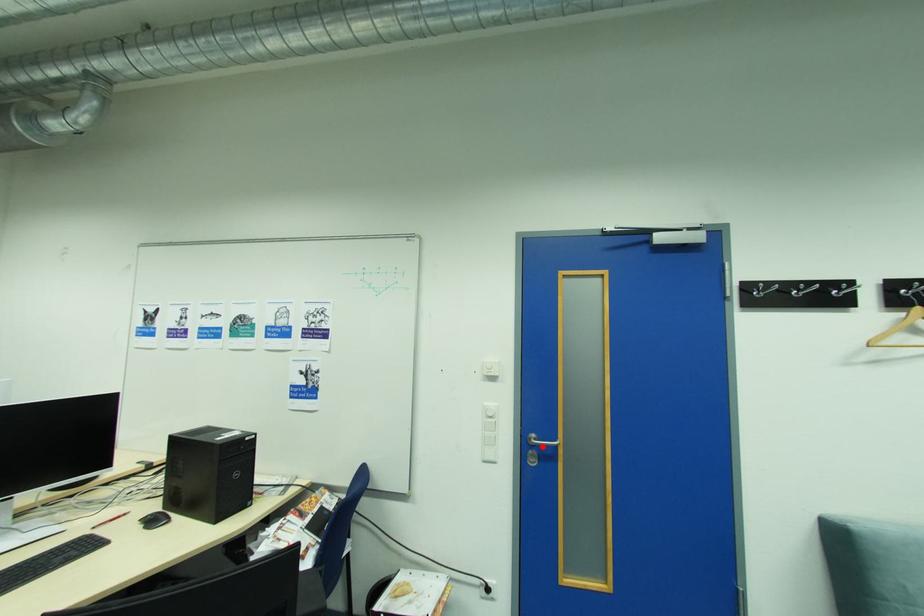
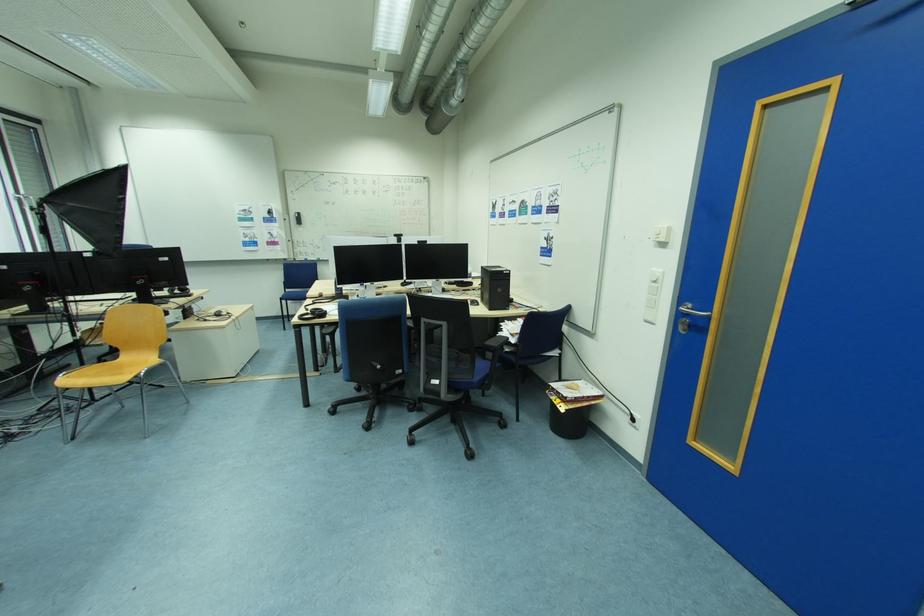
Where in the second image is the point corresponding to the highlighted location from the first image?

(695, 315)